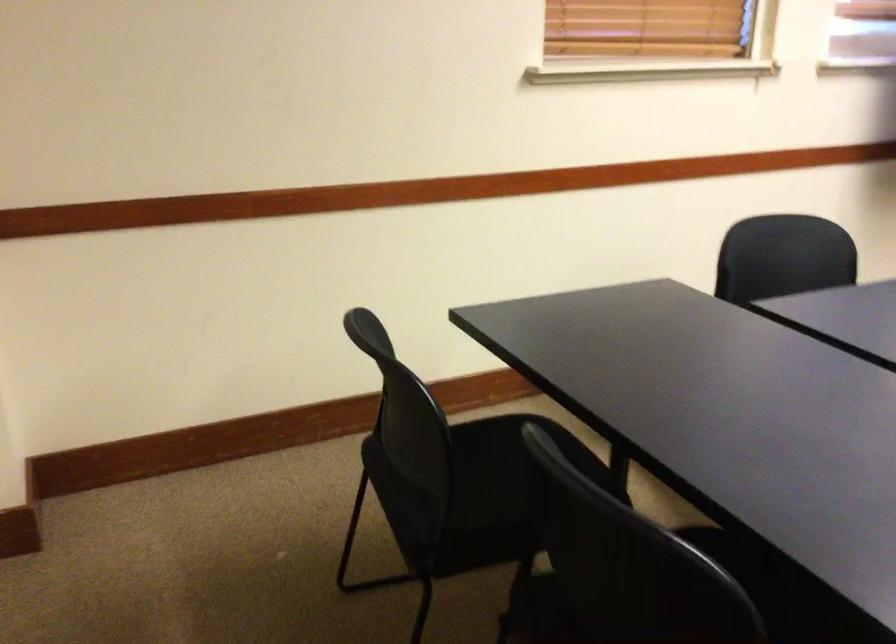
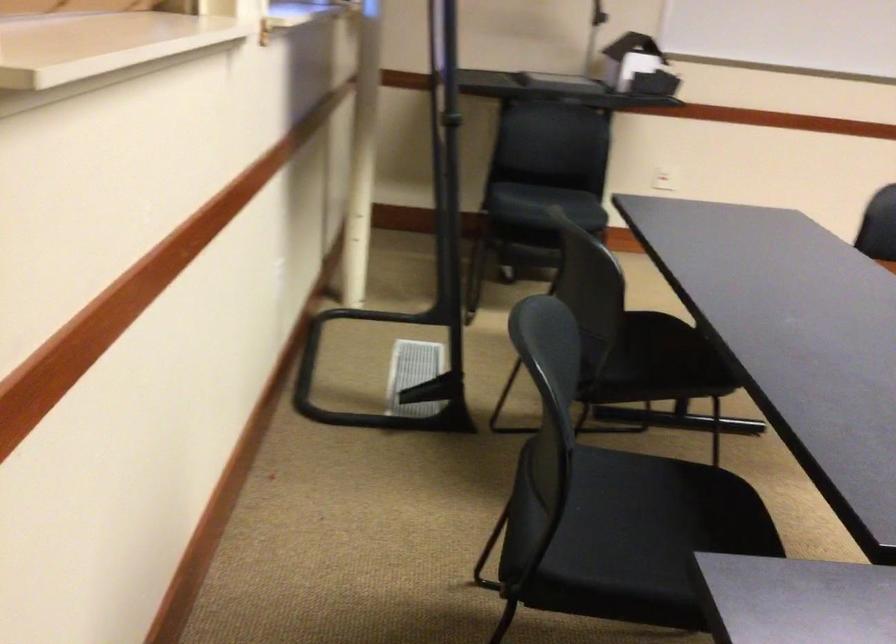
Question: What movement of the cameraman would produce the second image?

Choices:
 (A) Left
 (B) Right
 (C) Forward
 (D) Backward

Answer: (D)